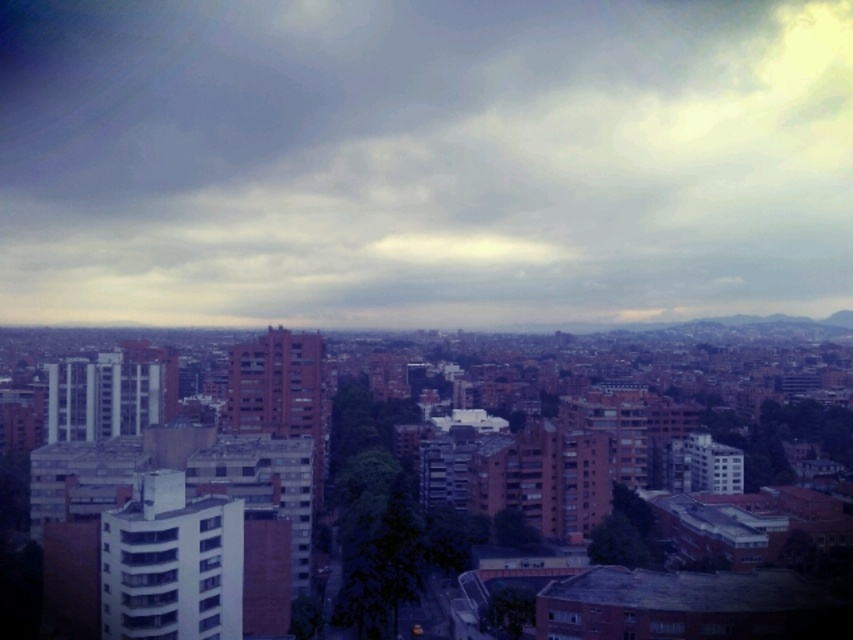
Who is positioned more to the right, cloudy sky at upper center or matte brick building at center?

cloudy sky at upper center is more to the right.

Which is more to the left, cloudy sky at upper center or matte brick building at center?

matte brick building at center

Find the location of a particular element. The width and height of the screenshot is (853, 640). cloudy sky at upper center is located at coordinates pyautogui.click(x=422, y=160).

Find the location of a particular element. cloudy sky at upper center is located at coordinates (422, 160).